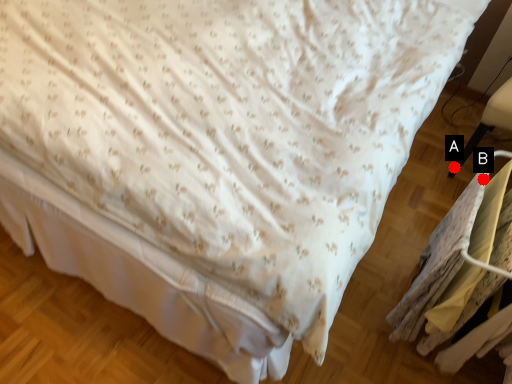
Question: Two points are circled on the image, labeled by A and B beside each circle. Among these points, which one is farthest from the camera?

Choices:
 (A) A is further
 (B) B is further

Answer: (A)